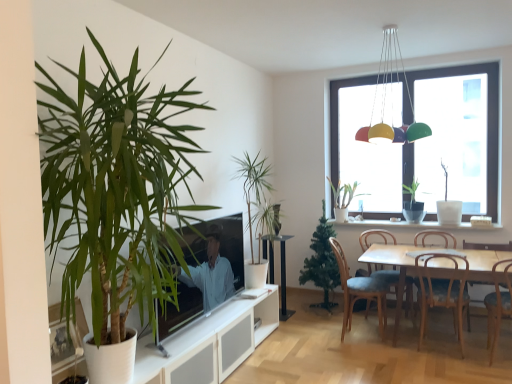
The width and height of the screenshot is (512, 384). Find the location of `free space that is in between brown wooden chair at lower right, which is counted as the second chair, starting from the right, and wooden chair at lower right, positioned as the 3th chair in right-to-left order`. free space that is in between brown wooden chair at lower right, which is counted as the second chair, starting from the right, and wooden chair at lower right, positioned as the 3th chair in right-to-left order is located at coordinates (474, 367).